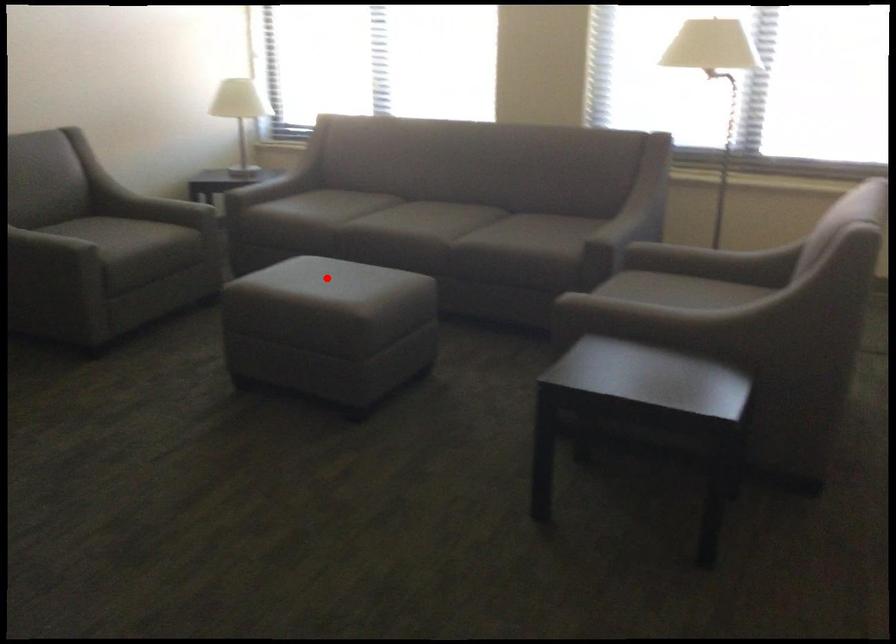
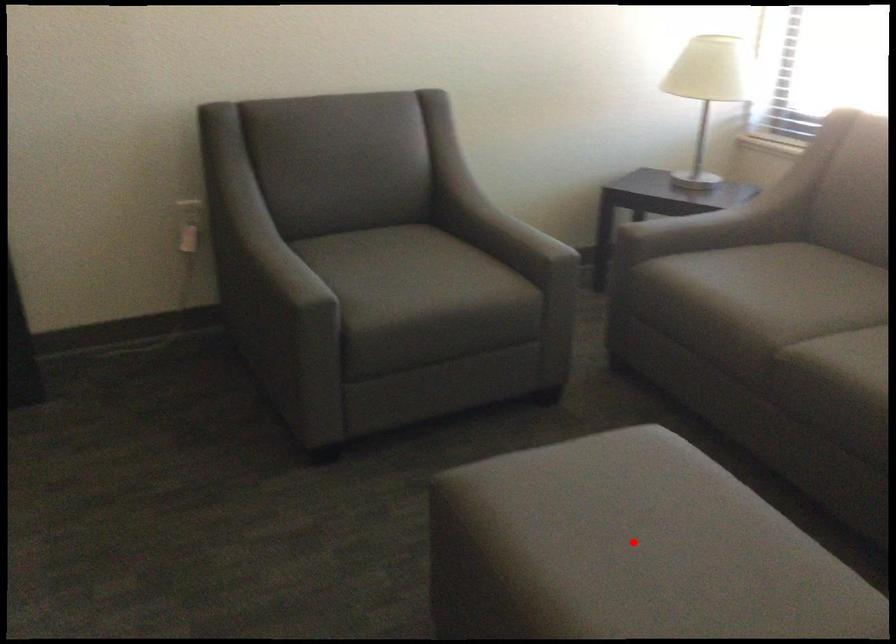
I am providing you with two images of the same scene from different viewpoints. A red point is marked on the first image and another point is marked on the second image. Are the points marked in image1 and image2 representing the same 3D position?

Yes